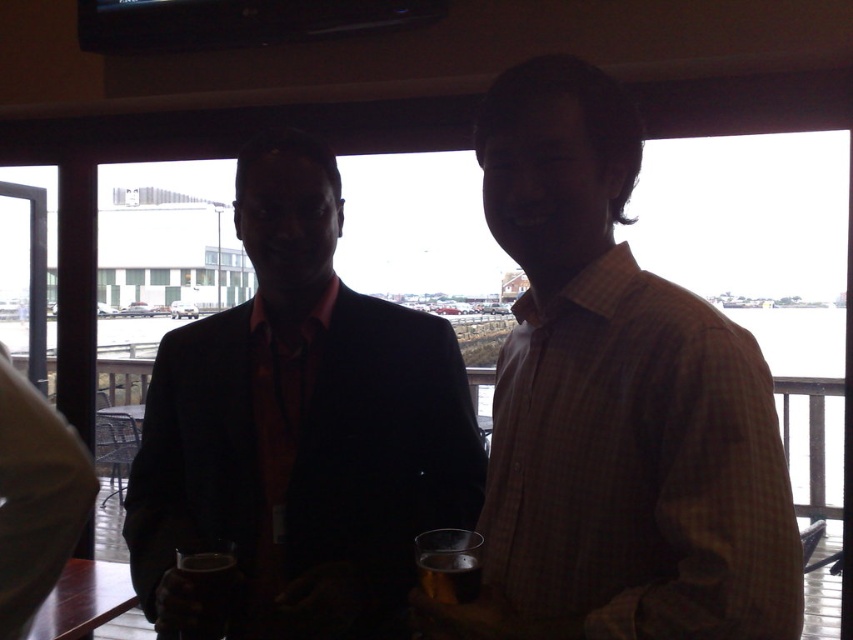
In the scene shown: You are a photographer trying to capture a portrait of both the brown checkered shirt at center and the translucent glass at center. Since you want to ensure both subjects are in focus, you need to know which one is taller. Can you determine which object is taller?

The brown checkered shirt at center is taller than the translucent glass at center, so you should adjust your camera settings to focus on the taller subject first.

Consider the image. You are a photographer standing at the camera position. You want to take a photo of the two people but need to ensure the translucent glass mug at lower left won

The translucent glass mug at lower left and camera are 1.05 meters apart from each other, so you can adjust your position to include both the people and the mug in the frame since they are within a reasonable distance.